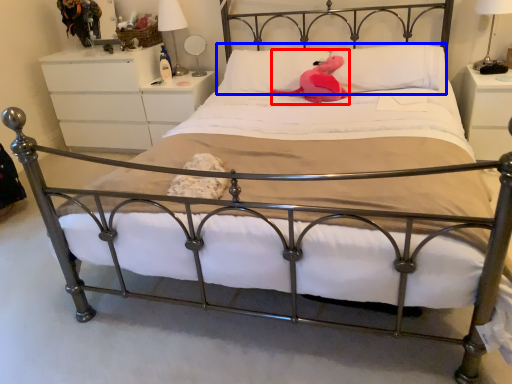
Question: Which point is closer to the camera, animal (highlighted by a red box) or pillow (highlighted by a blue box)?

Choices:
 (A) animal
 (B) pillow

Answer: (B)